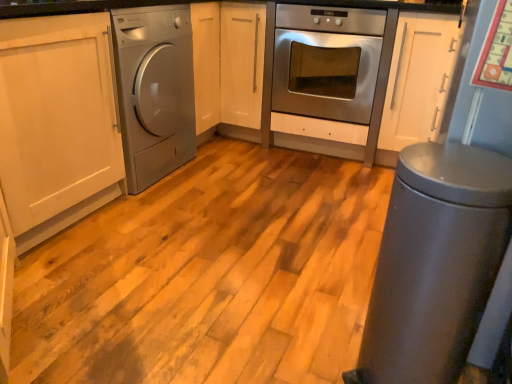
Question: Does metallic gray trash can at lower right have a greater height compared to satin silver washing machine at left?

Choices:
 (A) no
 (B) yes

Answer: (A)

Question: Considering the relative positions of metallic gray trash can at lower right and satin silver washing machine at left in the image provided, is metallic gray trash can at lower right to the left of satin silver washing machine at left from the viewer's perspective?

Choices:
 (A) no
 (B) yes

Answer: (A)

Question: Is metallic gray trash can at lower right at the right side of satin silver washing machine at left?

Choices:
 (A) yes
 (B) no

Answer: (A)

Question: Is metallic gray trash can at lower right further to the viewer compared to satin silver washing machine at left?

Choices:
 (A) no
 (B) yes

Answer: (A)

Question: Could you tell me if metallic gray trash can at lower right is facing satin silver washing machine at left?

Choices:
 (A) no
 (B) yes

Answer: (A)

Question: Looking at their shapes, would you say stainless steel oven at center is wider or thinner than white matte cabinet at center?

Choices:
 (A) thin
 (B) wide

Answer: (B)

Question: Relative to white matte cabinet at center, is stainless steel oven at center in front or behind?

Choices:
 (A) front
 (B) behind

Answer: (A)

Question: From a real-world perspective, is stainless steel oven at center physically located above or below white matte cabinet at center?

Choices:
 (A) below
 (B) above

Answer: (A)

Question: Is stainless steel oven at center taller or shorter than white matte cabinet at center?

Choices:
 (A) short
 (B) tall

Answer: (A)

Question: From their relative heights in the image, would you say metallic gray trash can at lower right is taller or shorter than white matte cabinet at center?

Choices:
 (A) tall
 (B) short

Answer: (B)

Question: Visually, is metallic gray trash can at lower right positioned to the left or to the right of white matte cabinet at center?

Choices:
 (A) left
 (B) right

Answer: (B)

Question: Considering their positions, is metallic gray trash can at lower right located in front of or behind white matte cabinet at center?

Choices:
 (A) behind
 (B) front

Answer: (B)

Question: Is point (414, 148) closer or farther from the camera than point (224, 117)?

Choices:
 (A) farther
 (B) closer

Answer: (B)

Question: Considering the positions of metallic gray trash can at lower right and stainless steel oven at center in the image, is metallic gray trash can at lower right wider or thinner than stainless steel oven at center?

Choices:
 (A) thin
 (B) wide

Answer: (A)

Question: From the image's perspective, is metallic gray trash can at lower right above or below stainless steel oven at center?

Choices:
 (A) below
 (B) above

Answer: (A)